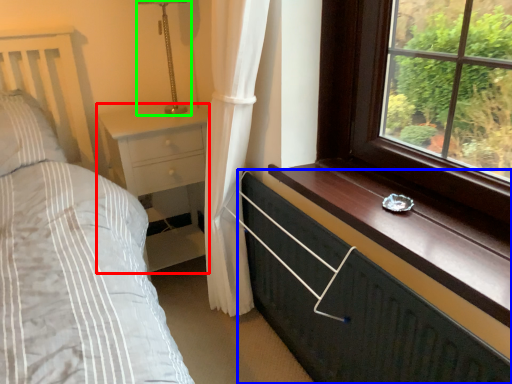
Question: Which object is the closest to the nightstand (highlighted by a red box)? Choose among these: chest of drawers (highlighted by a blue box) or table lamp (highlighted by a green box).

Choices:
 (A) chest of drawers
 (B) table lamp

Answer: (B)